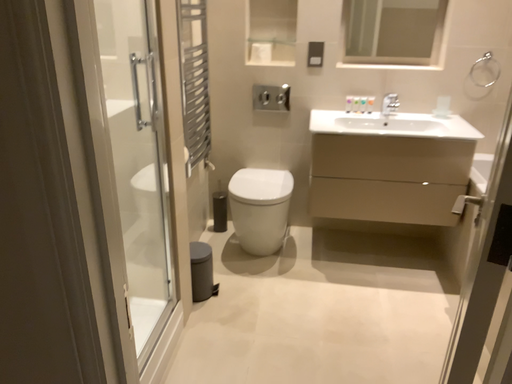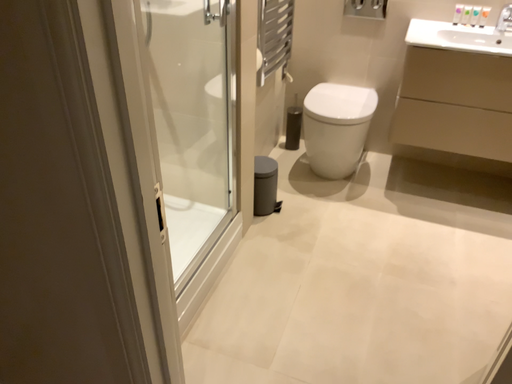
Question: Which way did the camera rotate in the video?

Choices:
 (A) rotated left
 (B) rotated right

Answer: (A)